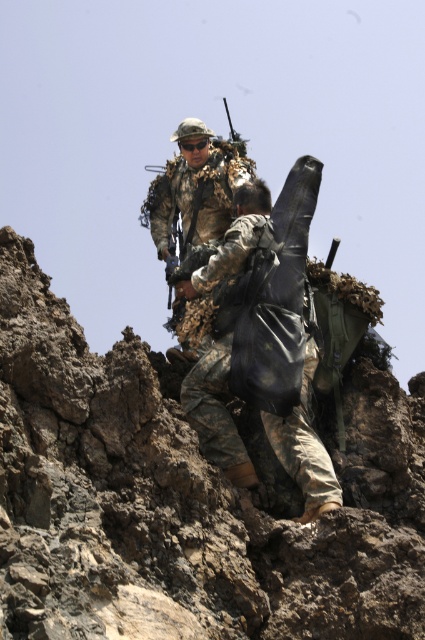
Based on the photo, measure the distance from camouflage fabric backpack at center to camouflage fabric uniform at center.

camouflage fabric backpack at center is 16.50 meters from camouflage fabric uniform at center.

Can you confirm if camouflage fabric backpack at center is positioned to the left of camouflage fabric uniform at center?

In fact, camouflage fabric backpack at center is to the right of camouflage fabric uniform at center.

Which is behind, point (252, 196) or point (164, 189)?

Positioned behind is point (164, 189).

Identify the location of camouflage fabric backpack at center. coord(217,412).

Is brown rugged rock at center further to camera compared to camouflage fabric uniform at center?

That is False.

Is point (167, 385) in front of point (175, 160)?

That is True.

The width and height of the screenshot is (425, 640). Identify the location of brown rugged rock at center. (187, 499).

Is point (224, 588) farther from camera compared to point (306, 506)?

No, (224, 588) is closer to viewer.

Who is more distant from viewer, (258, 518) or (204, 358)?

Positioned behind is point (204, 358).

This screenshot has height=640, width=425. Identify the location of brown rugged rock at center. (187, 499).